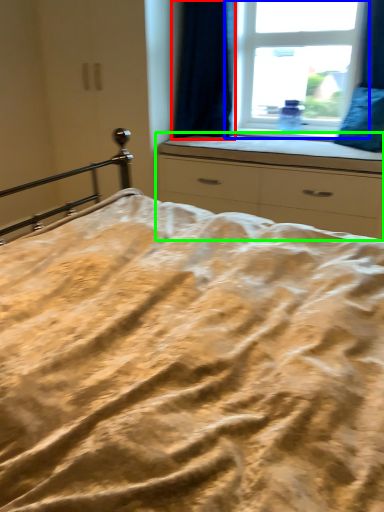
Question: Estimate the real-world distances between objects in this image. Which object is closer to curtain (highlighted by a red box), window (highlighted by a blue box) or chest of drawers (highlighted by a green box)?

Choices:
 (A) window
 (B) chest of drawers

Answer: (A)